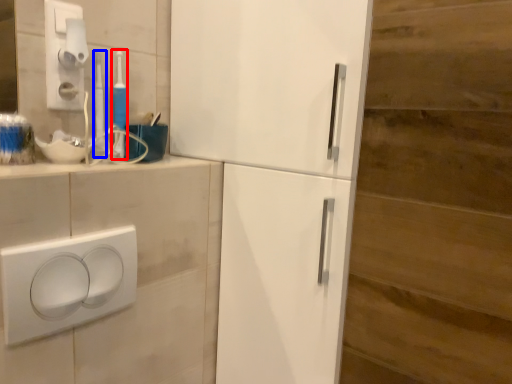
Question: Which of the following is the closest to the observer, toothbrush (highlighted by a red box) or toothbrush (highlighted by a blue box)?

Choices:
 (A) toothbrush
 (B) toothbrush

Answer: (B)